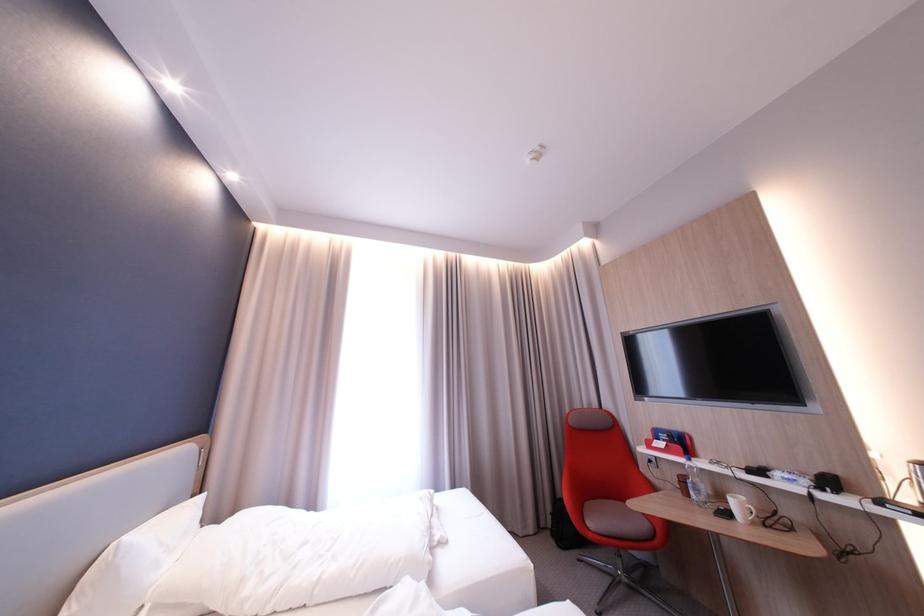
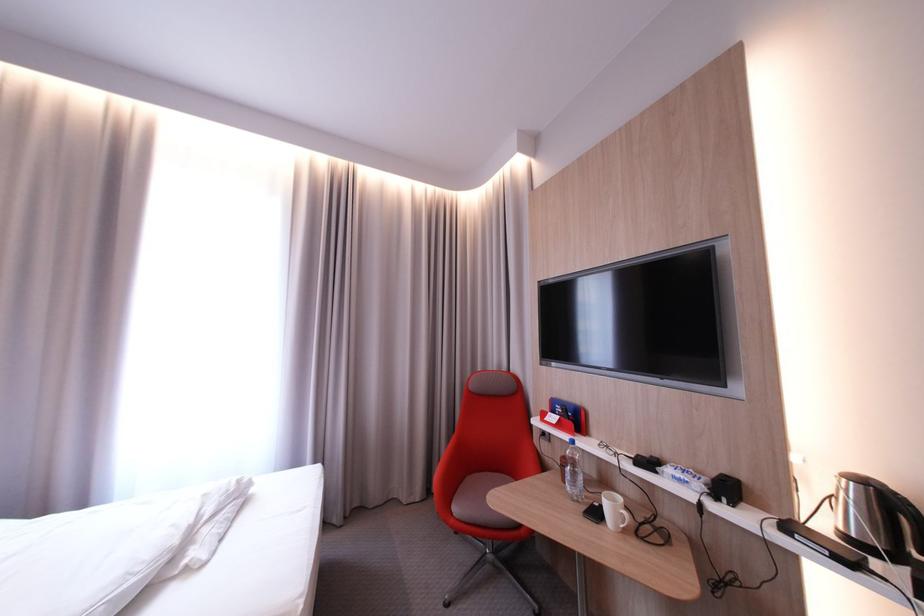
Locate, in the second image, the point that corresponds to (432,499) in the first image.

(215, 496)